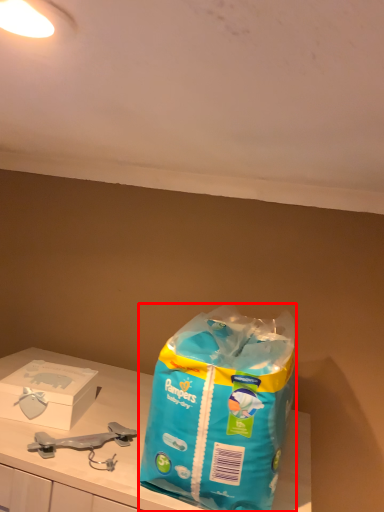
Question: From the image, what is the correct spatial relationship of shopping bag (annotated by the red box) in relation to box?

Choices:
 (A) right
 (B) left

Answer: (A)